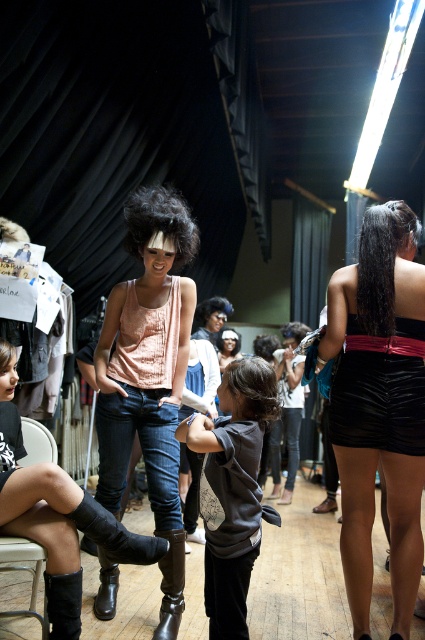
You are a stagehand carrying a 18 inch wide box. You need to place it between the dark gray sweatshirt at center and the black leather boots at lower left. Is there enough space?

The distance between the dark gray sweatshirt at center and the black leather boots at lower left is 17.99 inches. Since the box is 18 inches wide, there is not enough space to fit it between them.

You are standing in the backstage area and want to move from point A to point B. Point A is at coordinate point (377, 436) and point B is at coordinate point (176, 632). Which point is closer to you when you first arrive?

Point A at coordinate point (377, 436) is closer to you than point B at coordinate point (176, 632).